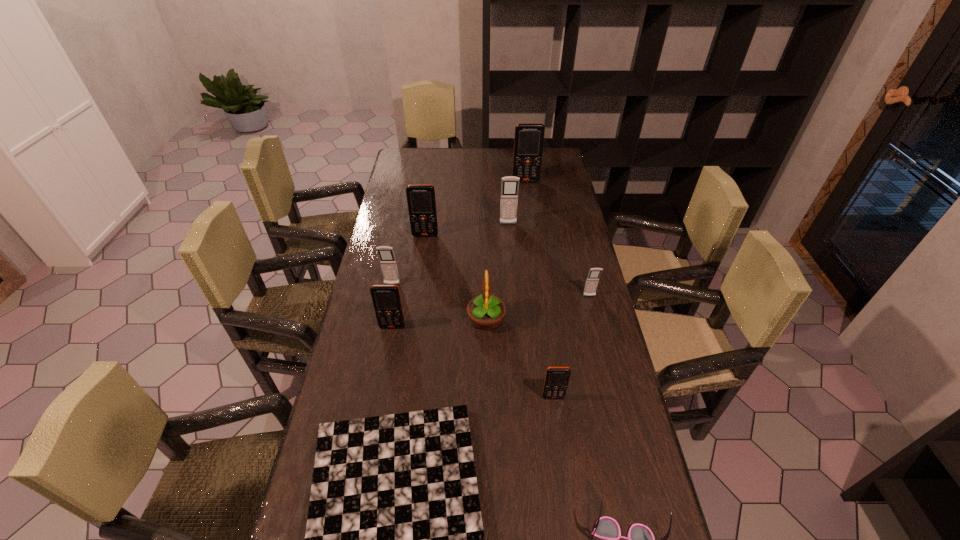
Locate an element on the screen. the second smallest orange cellular telephone is located at coordinates (386, 299).

What are the coordinates of `the smallest orange cellular telephone` in the screenshot? It's located at (556, 380).

Where is `the third nearest object`? The width and height of the screenshot is (960, 540). the third nearest object is located at coordinates (556, 380).

You are a GUI agent. You are given a task and a screenshot of the screen. Output one action in this format:
    pyautogui.click(x=<x>, y=<y>)
    Task: Click on the rightmost gray cellular telephone
    The height and width of the screenshot is (540, 960).
    Given the screenshot: What is the action you would take?
    pyautogui.click(x=592, y=280)

Locate an element on the screen. The height and width of the screenshot is (540, 960). the third nearest cellular telephone is located at coordinates (592, 280).

Find the location of a particular element. This screenshot has height=540, width=960. vacant area situated on the screen of the tallest object is located at coordinates 531,218.

The image size is (960, 540). Find the location of `vacant region located 0.270m on the front-facing side of the sixth nearest cellular telephone`. vacant region located 0.270m on the front-facing side of the sixth nearest cellular telephone is located at coordinates [512, 274].

Locate an element on the screen. free space located 0.150m on the screen of the fifth nearest cellular telephone is located at coordinates (421, 264).

Where is `free space located on the face of the yellow sunflower`? This screenshot has height=540, width=960. free space located on the face of the yellow sunflower is located at coordinates (432, 319).

The image size is (960, 540). Find the location of `vacant space located 0.260m on the face of the yellow sunflower`. vacant space located 0.260m on the face of the yellow sunflower is located at coordinates (385, 319).